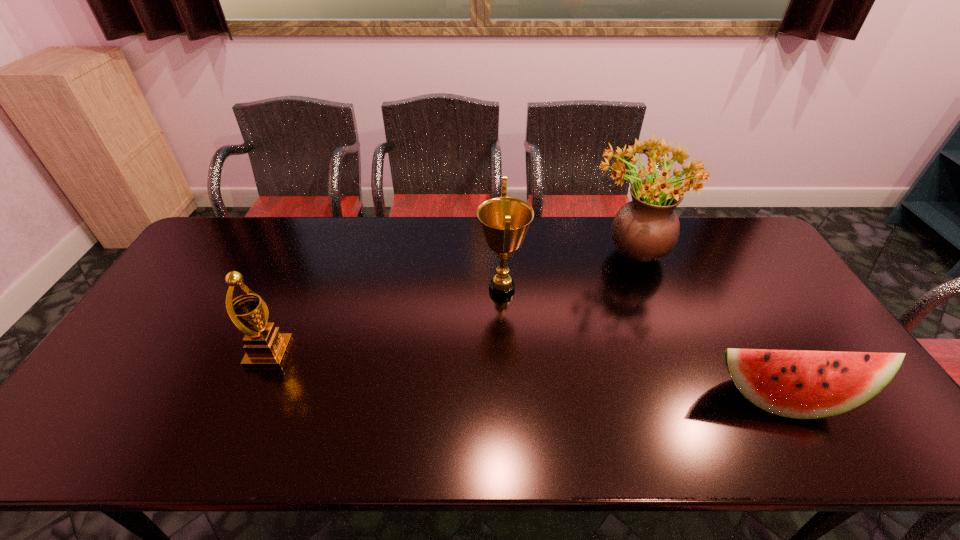
In the image, there is a desktop. Where is `vacant space at the right edge`? vacant space at the right edge is located at coordinates (833, 344).

Where is `free space at the far right corner of the desktop`? The width and height of the screenshot is (960, 540). free space at the far right corner of the desktop is located at coordinates 752,249.

I want to click on vacant space in between the third object from right to left and the nearer award, so click(x=386, y=321).

Identify the location of unoccupied position between the flower arrangement and the watermelon. (705, 325).

Find the location of a particular element. This screenshot has width=960, height=540. empty space between the nearer award and the flower arrangement is located at coordinates (449, 302).

Where is `vacant area that lies between the farther award and the third farthest object`? The height and width of the screenshot is (540, 960). vacant area that lies between the farther award and the third farthest object is located at coordinates (386, 321).

I want to click on free space that is in between the nearer award and the flower arrangement, so click(x=449, y=302).

Image resolution: width=960 pixels, height=540 pixels. In order to click on blank region between the flower arrangement and the watermelon in this screenshot , I will do `click(705, 325)`.

The width and height of the screenshot is (960, 540). I want to click on free space between the nearest object and the shorter award, so click(x=525, y=375).

I want to click on free area in between the left award and the flower arrangement, so click(449, 302).